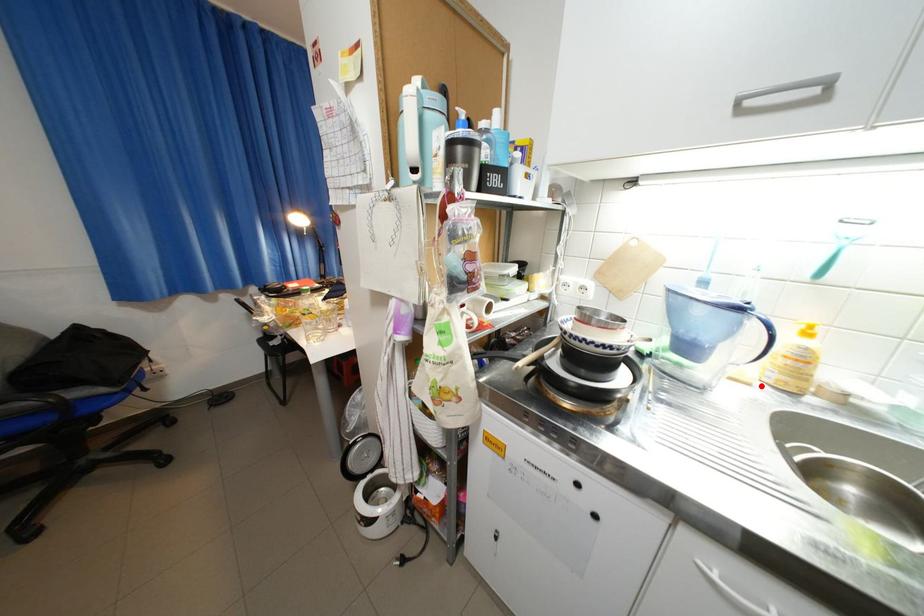
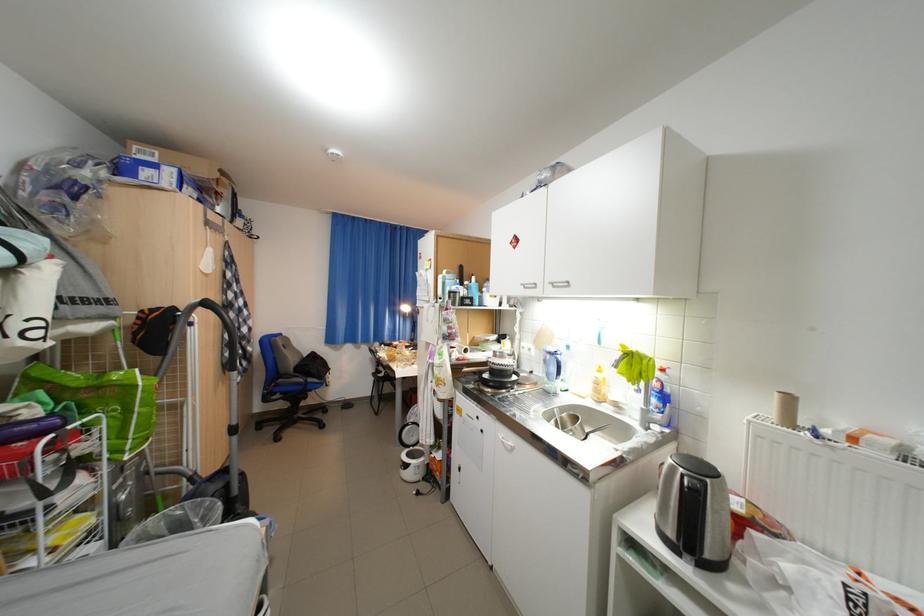
Question: I am providing you with two images of the same scene from different viewpoints. Given a red point in image1, look at the same physical point in image2. Is it:

Choices:
 (A) Closer to the viewpoint
 (B) Farther from the viewpoint

Answer: (B)